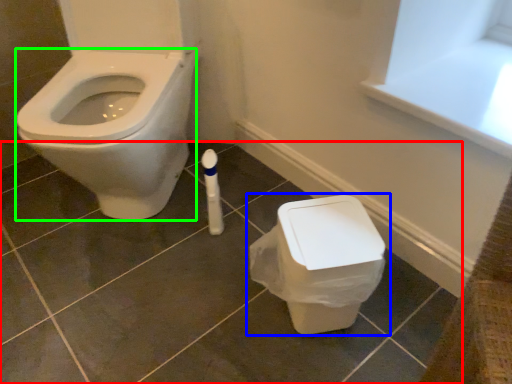
Question: Which is farther away from tile (highlighted by a red box)? toilet (highlighted by a blue box) or bidet (highlighted by a green box)?

Choices:
 (A) toilet
 (B) bidet

Answer: (B)